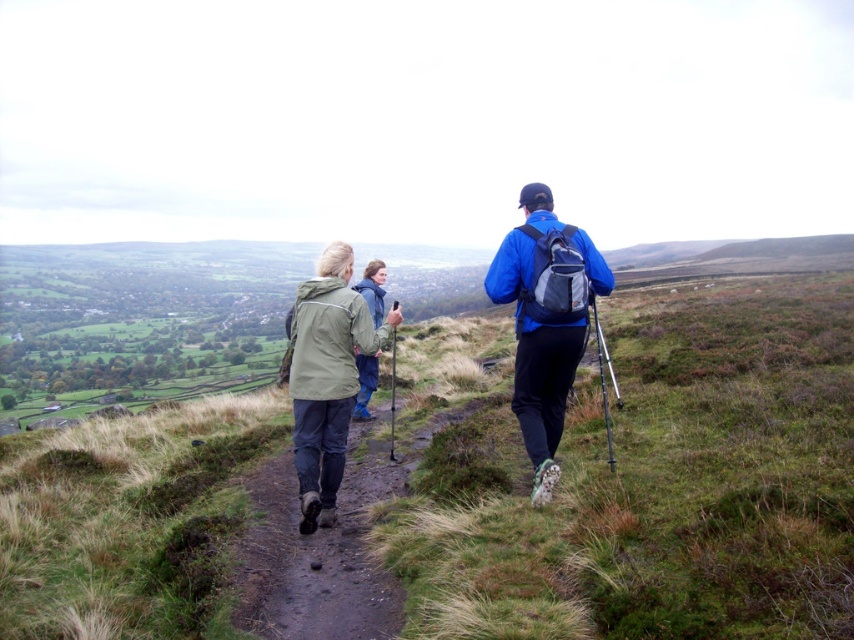
Question: Which object is the farthest from the green grassy at center?

Choices:
 (A) green matte jacket at center
 (B) blue matte jacket at center

Answer: (B)

Question: Among these points, which one is nearest to the camera?

Choices:
 (A) (180, 552)
 (B) (568, 275)
 (C) (325, 396)

Answer: (A)

Question: Which object is farther from the camera taking this photo?

Choices:
 (A) green grassy at center
 (B) blue matte jacket at center

Answer: (B)

Question: Does green grassy at center appear on the right side of blue matte jacket at center?

Choices:
 (A) yes
 (B) no

Answer: (A)

Question: In this image, where is green grassy at center located relative to blue matte jacket at center?

Choices:
 (A) above
 (B) below

Answer: (B)

Question: Is green grassy at center bigger than green matte jacket at center?

Choices:
 (A) no
 (B) yes

Answer: (B)